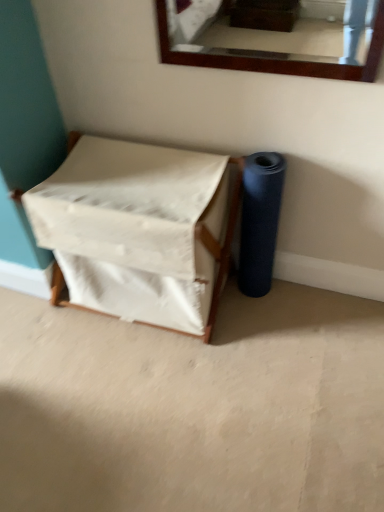
Find the location of a particular element. The image size is (384, 512). blue matte yoga mat at right is located at coordinates (260, 221).

What do you see at coordinates (260, 221) in the screenshot? The width and height of the screenshot is (384, 512). I see `blue matte yoga mat at right` at bounding box center [260, 221].

Describe the element at coordinates (138, 230) in the screenshot. I see `white fabric-covered box at center-left` at that location.

This screenshot has height=512, width=384. I want to click on white fabric-covered box at center-left, so click(x=138, y=230).

Locate an element on the screen. This screenshot has width=384, height=512. blue matte yoga mat at right is located at coordinates (260, 221).

Does white fabric-covered box at center-left appear on the right side of blue matte yoga mat at right?

Incorrect, white fabric-covered box at center-left is not on the right side of blue matte yoga mat at right.

Which is behind, white fabric-covered box at center-left or blue matte yoga mat at right?

blue matte yoga mat at right is further from the camera.

Which is behind, point (172, 220) or point (257, 251)?

The point (257, 251) is more distant.

From the image's perspective, which is above, white fabric-covered box at center-left or blue matte yoga mat at right?

blue matte yoga mat at right appears higher in the image.

From a real-world perspective, is white fabric-covered box at center-left located higher than blue matte yoga mat at right?

Actually, white fabric-covered box at center-left is physically below blue matte yoga mat at right in the real world.

Considering the sizes of white fabric-covered box at center-left and blue matte yoga mat at right in the image, is white fabric-covered box at center-left wider or thinner than blue matte yoga mat at right?

Clearly, white fabric-covered box at center-left has more width compared to blue matte yoga mat at right.

Considering the relative sizes of white fabric-covered box at center-left and blue matte yoga mat at right in the image provided, is white fabric-covered box at center-left shorter than blue matte yoga mat at right?

Indeed, white fabric-covered box at center-left has a lesser height compared to blue matte yoga mat at right.

Considering the sizes of objects white fabric-covered box at center-left and blue matte yoga mat at right in the image provided, who is smaller, white fabric-covered box at center-left or blue matte yoga mat at right?

blue matte yoga mat at right is smaller.

Can we say white fabric-covered box at center-left lies outside blue matte yoga mat at right?

Yes.

Is white fabric-covered box at center-left directly adjacent to blue matte yoga mat at right?

white fabric-covered box at center-left and blue matte yoga mat at right are not in contact.

Could you tell me if white fabric-covered box at center-left is facing blue matte yoga mat at right?

No, white fabric-covered box at center-left does not turn towards blue matte yoga mat at right.

Find the location of a particular element. This screenshot has height=512, width=384. furniture below the blue matte yoga mat at right (from the image's perspective) is located at coordinates (138, 230).

Considering the relative positions of blue matte yoga mat at right and white fabric-covered box at center-left in the image provided, is blue matte yoga mat at right to the left or to the right of white fabric-covered box at center-left?

From the image, it's evident that blue matte yoga mat at right is to the right of white fabric-covered box at center-left.

Does blue matte yoga mat at right come behind white fabric-covered box at center-left?

Yes, blue matte yoga mat at right is further from the camera.

Considering the points (262, 211) and (213, 238), which point is behind, point (262, 211) or point (213, 238)?

The point (213, 238) is farther from the camera.

From the image's perspective, is blue matte yoga mat at right located above or below white fabric-covered box at center-left?

blue matte yoga mat at right is situated higher than white fabric-covered box at center-left in the image.

From a real-world perspective, is blue matte yoga mat at right physically located above or below white fabric-covered box at center-left?

From a real-world perspective, blue matte yoga mat at right is physically above white fabric-covered box at center-left.

Is blue matte yoga mat at right wider than white fabric-covered box at center-left?

Incorrect, the width of blue matte yoga mat at right does not surpass that of white fabric-covered box at center-left.

Who is shorter, blue matte yoga mat at right or white fabric-covered box at center-left?

white fabric-covered box at center-left.

Does blue matte yoga mat at right have a larger size compared to white fabric-covered box at center-left?

No.

From the picture: Is blue matte yoga mat at right positioned beyond the bounds of white fabric-covered box at center-left?

Yes, blue matte yoga mat at right is not within white fabric-covered box at center-left.

Are blue matte yoga mat at right and white fabric-covered box at center-left far apart?

No, blue matte yoga mat at right is in close proximity to white fabric-covered box at center-left.

Does blue matte yoga mat at right turn towards white fabric-covered box at center-left?

No, blue matte yoga mat at right does not turn towards white fabric-covered box at center-left.

How different are the orientations of blue matte yoga mat at right and white fabric-covered box at center-left in degrees?

0.00142 degrees.

You are a GUI agent. You are given a task and a screenshot of the screen. Output one action in this format:
    pyautogui.click(x=<x>, y=<y>)
    Task: Click on the toilet paper behind the white fabric-covered box at center-left
    The height and width of the screenshot is (512, 384).
    Given the screenshot: What is the action you would take?
    pyautogui.click(x=260, y=221)

At what (x,y) coordinates should I click in order to perform the action: click on furniture below the blue matte yoga mat at right (from the image's perspective). Please return your answer as a coordinate pair (x, y). The image size is (384, 512). Looking at the image, I should click on (138, 230).

The height and width of the screenshot is (512, 384). I want to click on toilet paper located above the white fabric-covered box at center-left (from the image's perspective), so click(x=260, y=221).